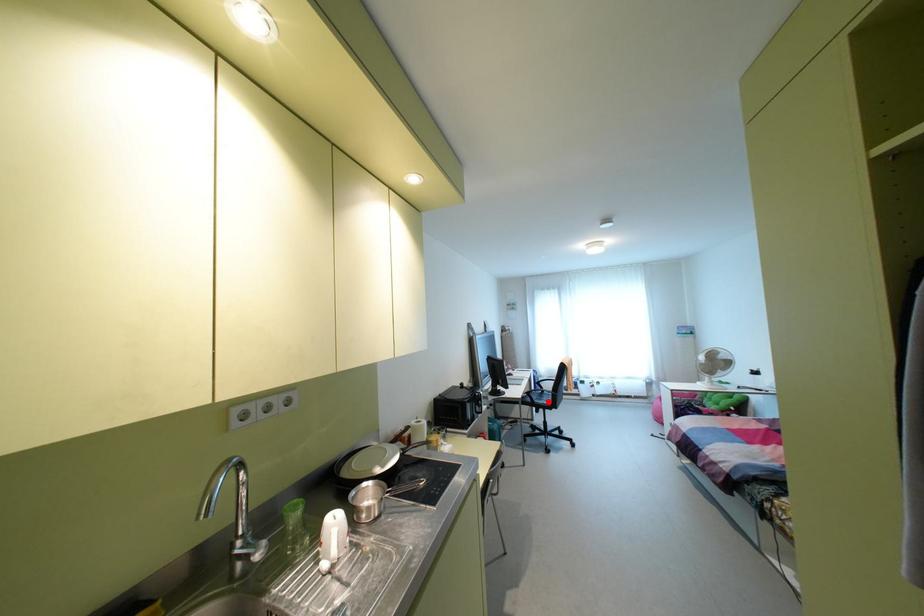
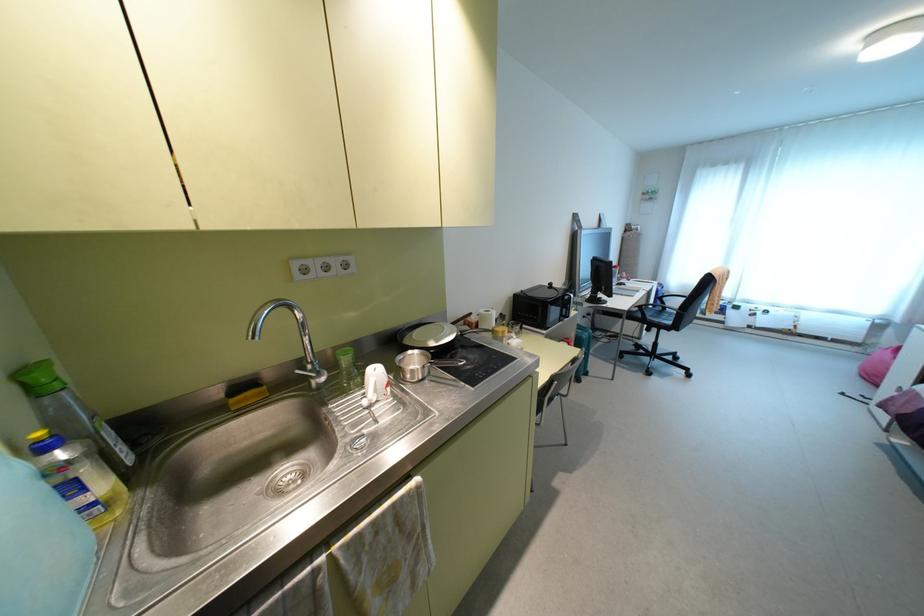
Question: I am providing you with two images of the same scene from different viewpoints. Image1 has a red point marked. In image2, the corresponding 3D location appears at what relative position? Reply with the corresponding letter.

Choices:
 (A) Closer
 (B) Farther

Answer: (A)